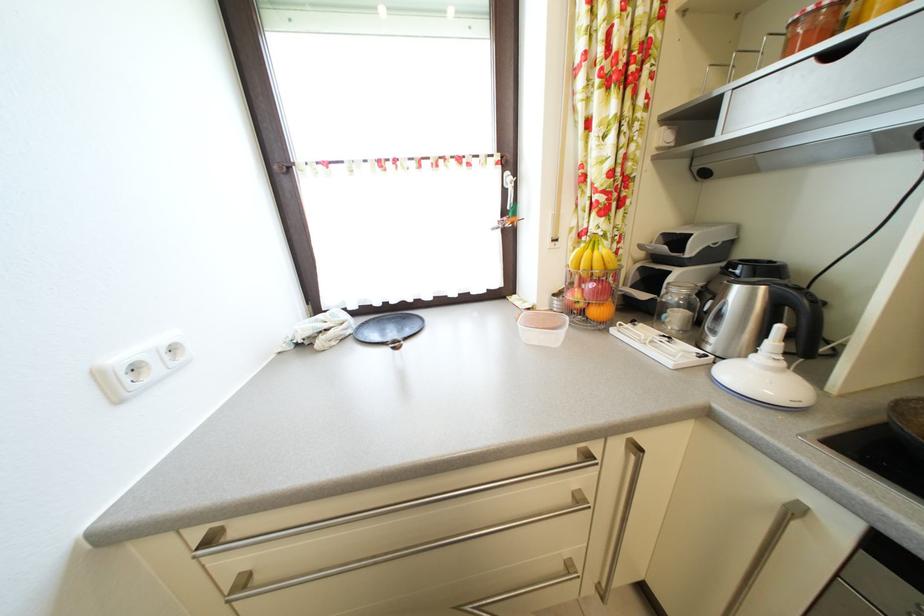
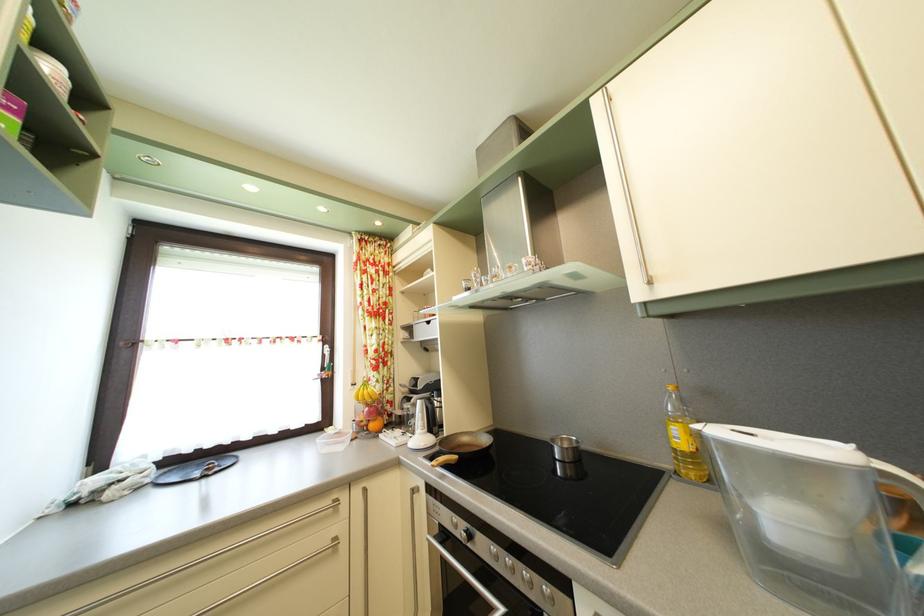
The first image is from the beginning of the video and the second image is from the end. How did the camera likely rotate when shooting the video?

The rotation direction of the camera is right-up.